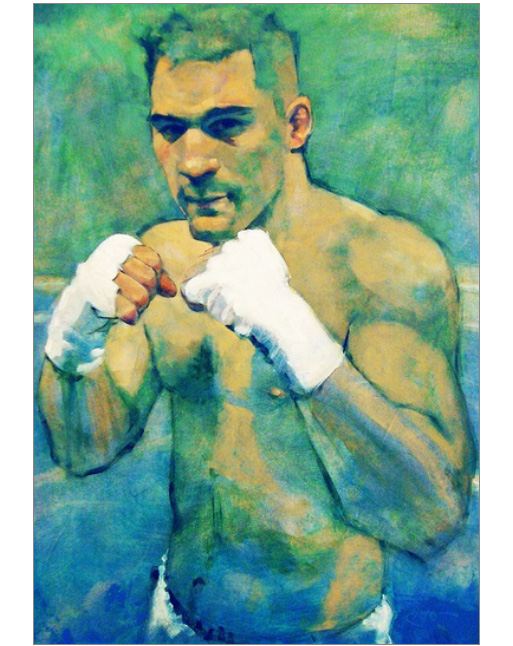
I want to click on chest, so click(x=247, y=375), click(x=164, y=351).